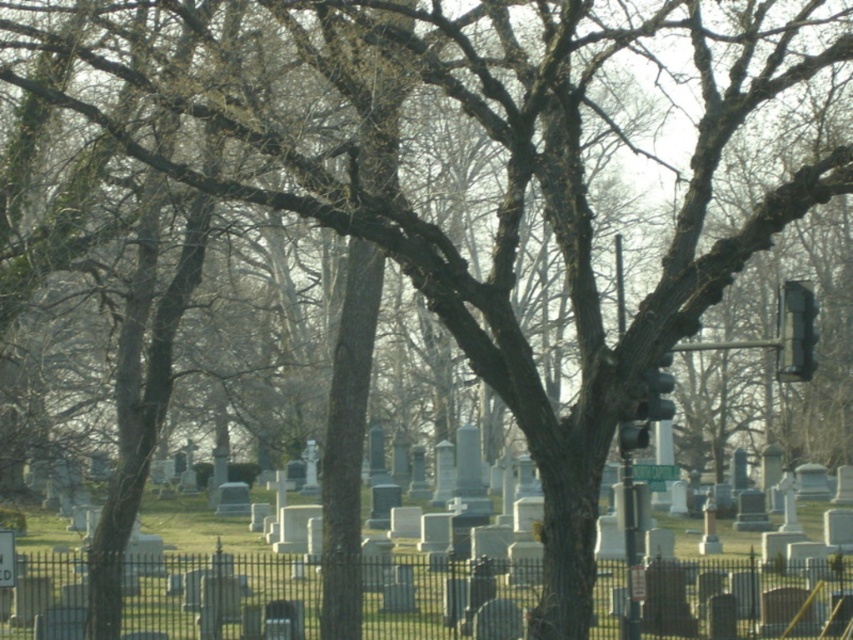
You are a photographer planning to capture the white stone gravestones at center and the black plastic traffic light at right in a single frame. Based on their heights, which object will appear larger in the photo?

The white stone gravestones at center will appear larger in the photo because they are much taller than the black plastic traffic light at right.

You are standing in the cemetery and want to place a new gravestone at the point marked as point (746, 596). According to the scene description, what type of gravestone is already located there?

The point (746, 596) corresponds to white stone gravestones at center, so the existing gravestone there is a white stone gravestone.

You are standing at the entrance of the cemetery and want to visit the white stone gravestones at center. According to the coordinates provided, in which direction should you walk from the entrance to reach them?

The white stone gravestones at center are located at coordinates point [746,596]. Since the entrance is typically at the lower left corner of the scene, you should walk towards the upper right direction to reach them.